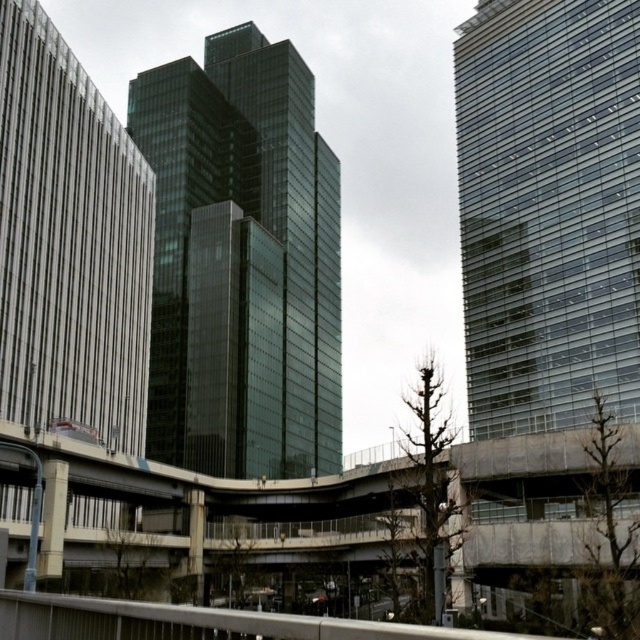
Question: Which point appears closest to the camera in this image?

Choices:
 (A) (536, 172)
 (B) (193, 161)

Answer: (A)

Question: Can you confirm if glassy black skyscraper at center is positioned above transparent glass tower at right?

Choices:
 (A) no
 (B) yes

Answer: (B)

Question: Is glassy black skyscraper at center thinner than transparent glass tower at right?

Choices:
 (A) yes
 (B) no

Answer: (B)

Question: Which point appears closest to the camera in this image?

Choices:
 (A) (490, 298)
 (B) (205, 212)

Answer: (A)

Question: Which point appears farthest from the camera in this image?

Choices:
 (A) (252, 291)
 (B) (536, 45)

Answer: (A)

Question: Is glassy black skyscraper at center thinner than transparent glass tower at right?

Choices:
 (A) yes
 (B) no

Answer: (B)